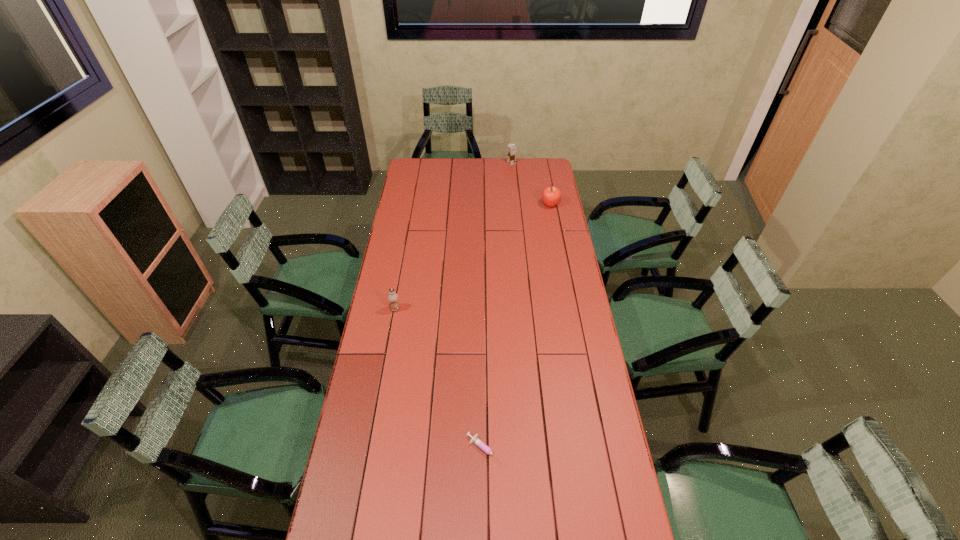
Find the location of a particular element. This screenshot has height=540, width=960. the farthest object is located at coordinates (511, 149).

Where is `the right chocolate milk`? The width and height of the screenshot is (960, 540). the right chocolate milk is located at coordinates (511, 149).

This screenshot has height=540, width=960. Find the location of `the leftmost object`. the leftmost object is located at coordinates (392, 297).

Locate an element on the screen. The image size is (960, 540). the left chocolate milk is located at coordinates (392, 297).

Image resolution: width=960 pixels, height=540 pixels. I want to click on the rightmost object, so click(551, 195).

The height and width of the screenshot is (540, 960). In order to click on apple in this screenshot , I will do `click(551, 195)`.

Where is `syringe`? syringe is located at coordinates (475, 439).

Locate an element on the screen. the shortest object is located at coordinates (475, 439).

This screenshot has width=960, height=540. Identify the location of blank area located 0.120m on the left of the right chocolate milk. (487, 163).

Identify the location of free space located on the front of the second nearest object. Image resolution: width=960 pixels, height=540 pixels. (381, 387).